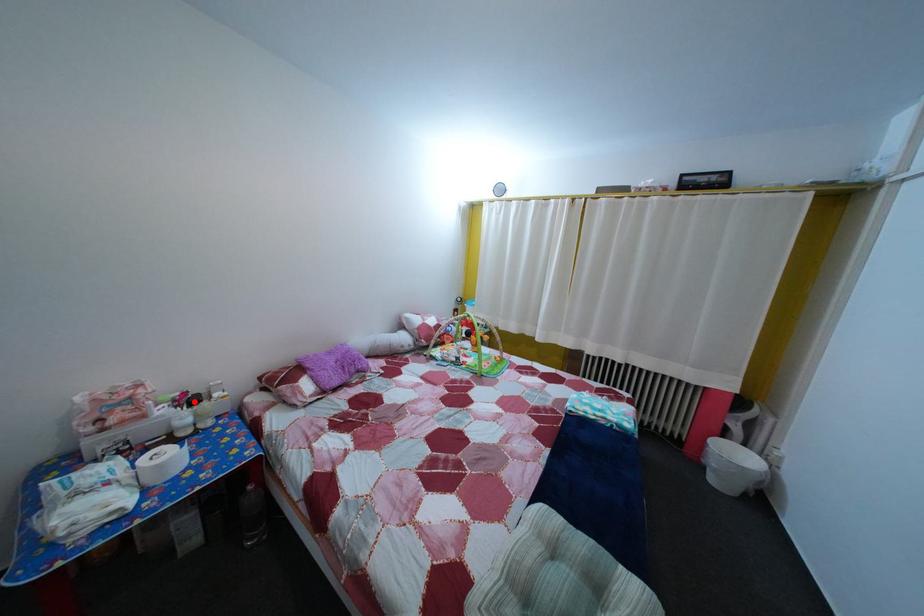
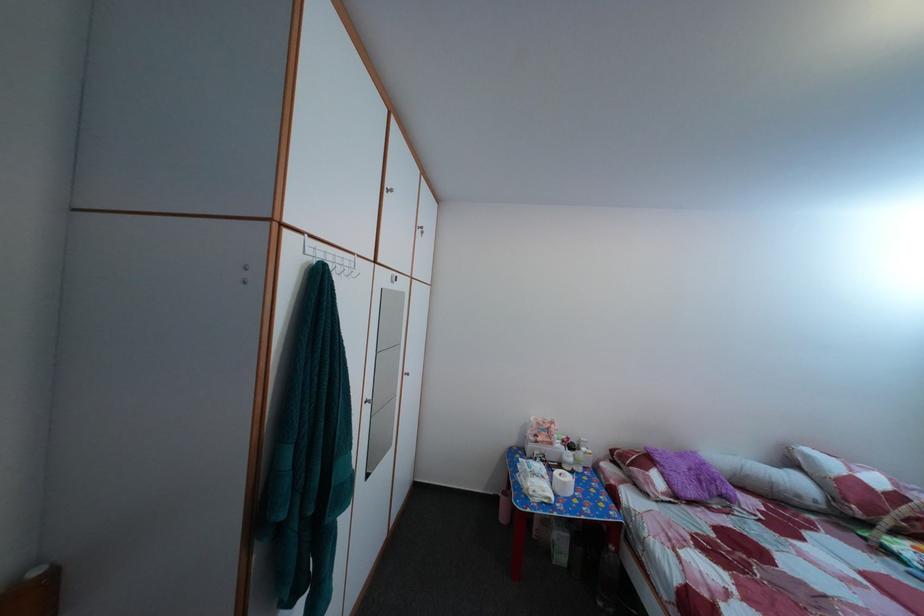
In the second image, find the point that corresponds to the highlighted location in the first image.

(578, 447)